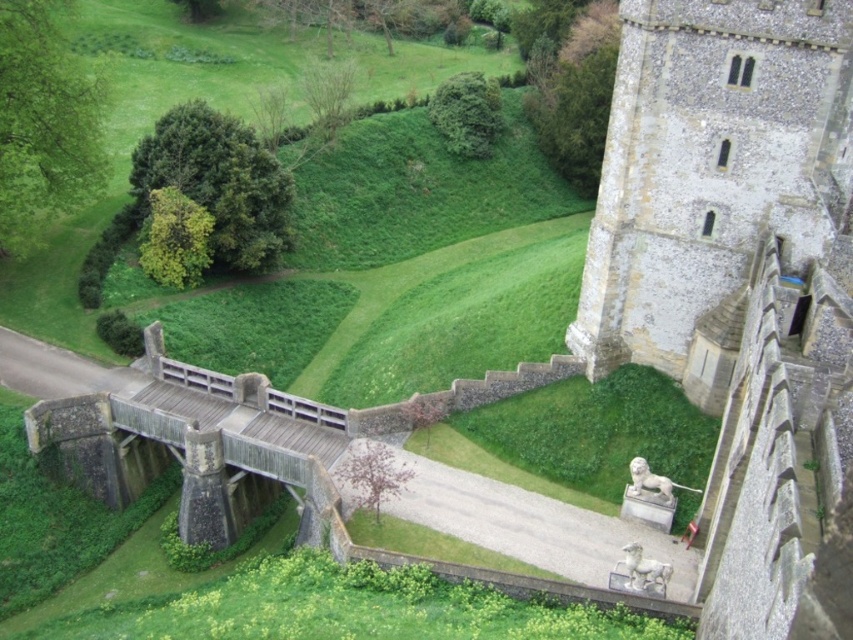
Question: Does stone tower at right appear over wooden bridge at lower left?

Choices:
 (A) yes
 (B) no

Answer: (A)

Question: Which point appears farthest from the camera in this image?

Choices:
 (A) (621, 141)
 (B) (262, 472)

Answer: (B)

Question: Which point is farther from the camera taking this photo?

Choices:
 (A) (320, 452)
 (B) (735, 148)

Answer: (A)

Question: Can you confirm if stone tower at right is smaller than wooden bridge at lower left?

Choices:
 (A) yes
 (B) no

Answer: (B)

Question: Does stone tower at right appear on the left side of wooden bridge at lower left?

Choices:
 (A) yes
 (B) no

Answer: (B)

Question: Which point is farther to the camera?

Choices:
 (A) wooden bridge at lower left
 (B) stone tower at right

Answer: (A)